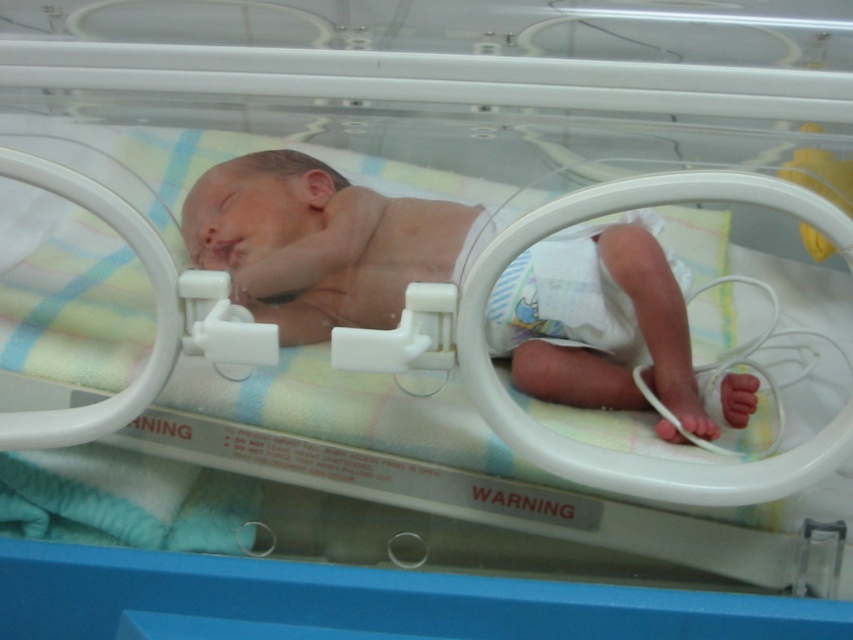
Can you confirm if smooth skin newborn at center is positioned above white cloth diaper at lower right?

Correct, smooth skin newborn at center is located above white cloth diaper at lower right.

At what (x,y) coordinates should I click in order to perform the action: click on smooth skin newborn at center. Please return your answer as a coordinate pair (x, y). The width and height of the screenshot is (853, 640). Looking at the image, I should click on (322, 243).